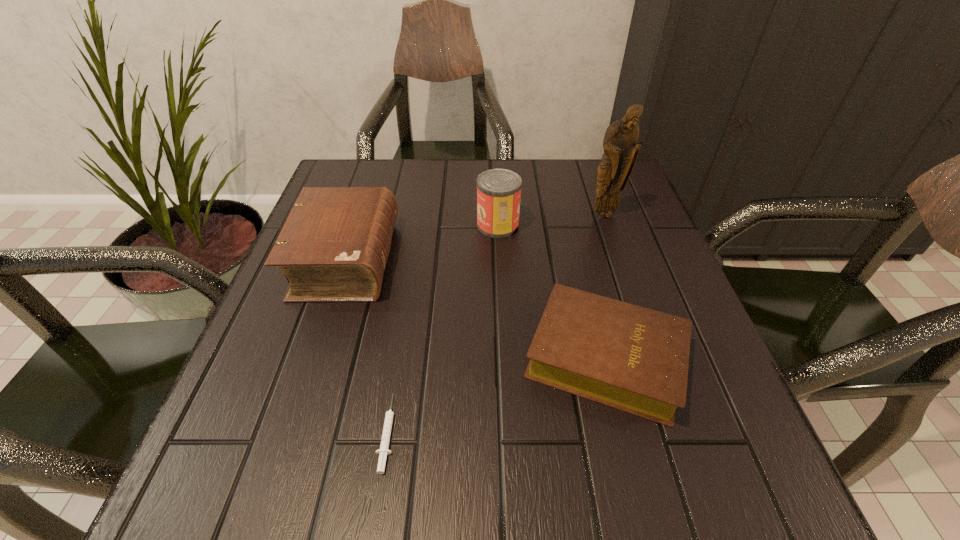
In order to click on free space that is in between the can and the syringe in this screenshot , I will do `click(443, 329)`.

Identify the location of free space between the shorter Bible and the can. The height and width of the screenshot is (540, 960). (552, 292).

The width and height of the screenshot is (960, 540). In order to click on vacant space that's between the figurine and the fourth object from right to left in this screenshot , I will do `click(496, 323)`.

The width and height of the screenshot is (960, 540). Identify the location of free spot between the fourth object from right to left and the left Bible. (367, 346).

This screenshot has width=960, height=540. I want to click on free space between the tallest object and the can, so tap(551, 220).

The height and width of the screenshot is (540, 960). I want to click on the second closest object relative to the tallest object, so [x=631, y=358].

Find the location of a particular element. object identified as the closest to the can is located at coordinates (621, 150).

The width and height of the screenshot is (960, 540). I want to click on vacant position in the image that satisfies the following two spatial constraints: 1. on the spine side of the shortest object; 2. on the left side of the farther Bible, so click(x=289, y=433).

Locate an element on the screen. Image resolution: width=960 pixels, height=540 pixels. vacant position in the image that satisfies the following two spatial constraints: 1. on the back side of the can; 2. on the right side of the second object from left to right is located at coordinates (420, 225).

The width and height of the screenshot is (960, 540). Identify the location of free space that satisfies the following two spatial constraints: 1. on the spine side of the shorter Bible; 2. on the left side of the left Bible. (314, 357).